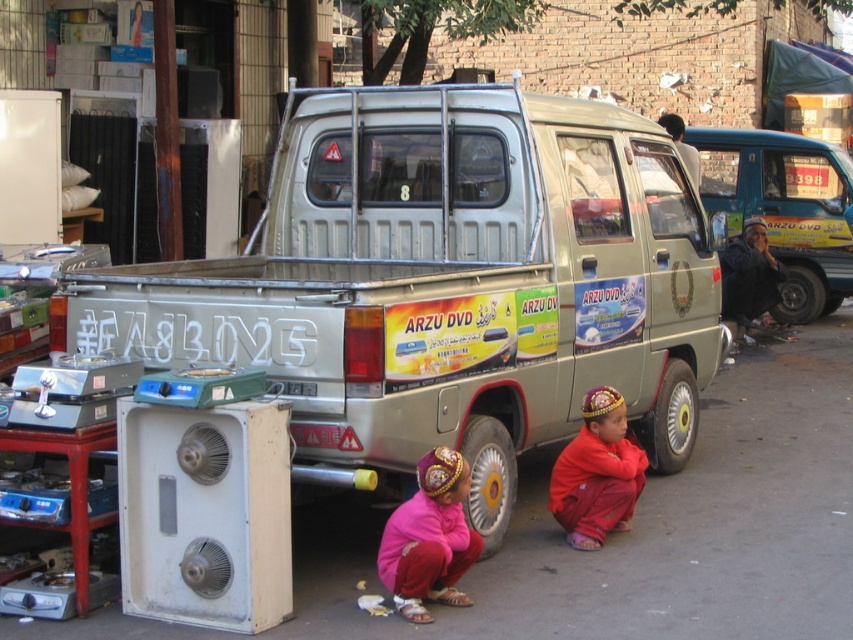
Question: Based on their relative distances, which object is farther from the yellow rubber tire at lower right?

Choices:
 (A) red cotton pants at lower center
 (B) metallic silver van at right

Answer: (B)

Question: Is metallic silver van at right behind red cotton pants at lower center?

Choices:
 (A) no
 (B) yes

Answer: (B)

Question: Is metallic silver van at right bigger than white metallic tire at lower center?

Choices:
 (A) yes
 (B) no

Answer: (A)

Question: Among these objects, which one is nearest to the camera?

Choices:
 (A) red cotton pants at lower center
 (B) white metallic tire at lower center
 (C) black rubber tire at lower right

Answer: (B)

Question: Can you confirm if pink fabric pants at lower center is thinner than white metallic tire at lower center?

Choices:
 (A) yes
 (B) no

Answer: (B)

Question: Which point is farther from the camera taking this photo?

Choices:
 (A) (399, 563)
 (B) (578, 444)
 (C) (659, 465)

Answer: (C)